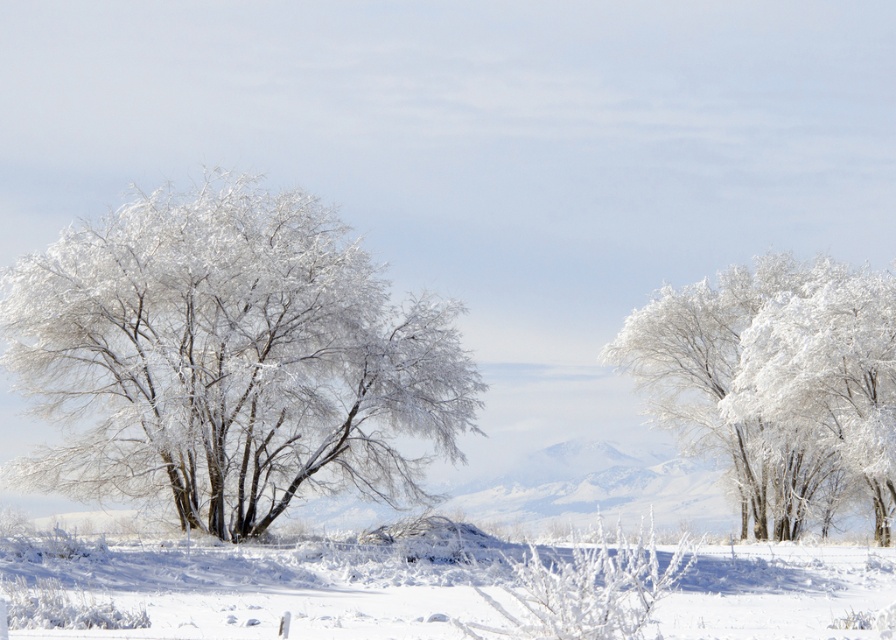
Question: Which point is farther from the camera taking this photo?

Choices:
 (A) (820, 340)
 (B) (233, 225)

Answer: (A)

Question: Is frosted white tree at left smaller than frosted white trees at center?

Choices:
 (A) no
 (B) yes

Answer: (B)

Question: In this image, where is frosted white tree at left located relative to frosted white trees at center?

Choices:
 (A) left
 (B) right

Answer: (A)

Question: Which point is farther to the camera?

Choices:
 (A) (306, 410)
 (B) (694, 396)

Answer: (B)

Question: In this image, where is frosted white tree at left located relative to frosted white trees at center?

Choices:
 (A) below
 (B) above

Answer: (B)